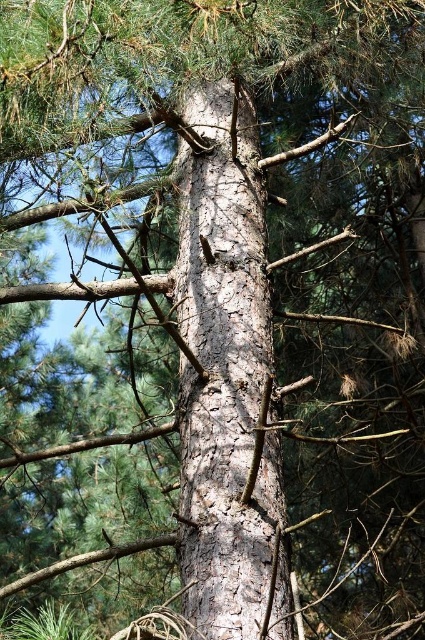
You are a bird looking for a place to perch on the brown rough branch at lower left. Where exactly on the branch should you land?

The brown rough branch at lower left is located at point (85, 561), so you should land at that coordinate.

You are a bird with a wingspan of 12 inches. You want to perch on the branches in the image. Can you fit between the brown rough branch at lower left and the brown rough branch at upper left without overlapping them?

The distance between the brown rough branch at lower left and the brown rough branch at upper left is 12.94 inches. Since your wingspan is 12 inches, you can fit between them without overlapping.

You are an arborist examining the tree trunk. You notice two branches, the brown rough branch at lower left and the brown rough branch at upper left. Which branch is thicker?

The brown rough branch at upper left is thicker than the brown rough branch at lower left.